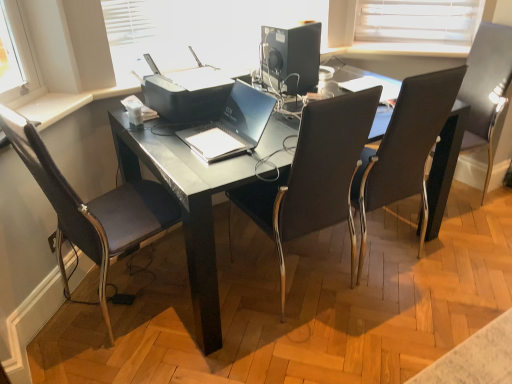
Where is `empty space that is to the right of black leather chair at center, placed as the third chair when sorted from left to right`? empty space that is to the right of black leather chair at center, placed as the third chair when sorted from left to right is located at coordinates (449, 253).